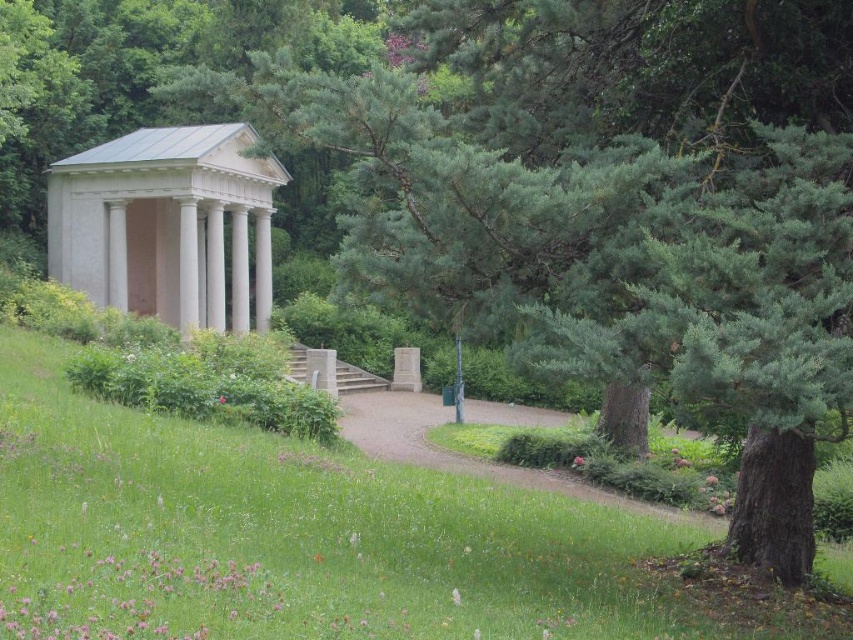
Question: Estimate the real-world distances between objects in this image. Which object is farther from the gravel path at center?

Choices:
 (A) green grassy at lower left
 (B) white smooth gazebo at center

Answer: (B)

Question: Which object is the farthest from the gravel path at center?

Choices:
 (A) green grassy at lower left
 (B) white smooth gazebo at center

Answer: (B)

Question: Is green grassy at lower left positioned before white smooth gazebo at center?

Choices:
 (A) no
 (B) yes

Answer: (B)

Question: Is green grassy at lower left closer to camera compared to white smooth gazebo at center?

Choices:
 (A) yes
 (B) no

Answer: (A)

Question: Which point is closer to the camera?

Choices:
 (A) (610, 582)
 (B) (154, 308)

Answer: (A)

Question: Is green grassy at lower left positioned behind gravel path at center?

Choices:
 (A) yes
 (B) no

Answer: (B)